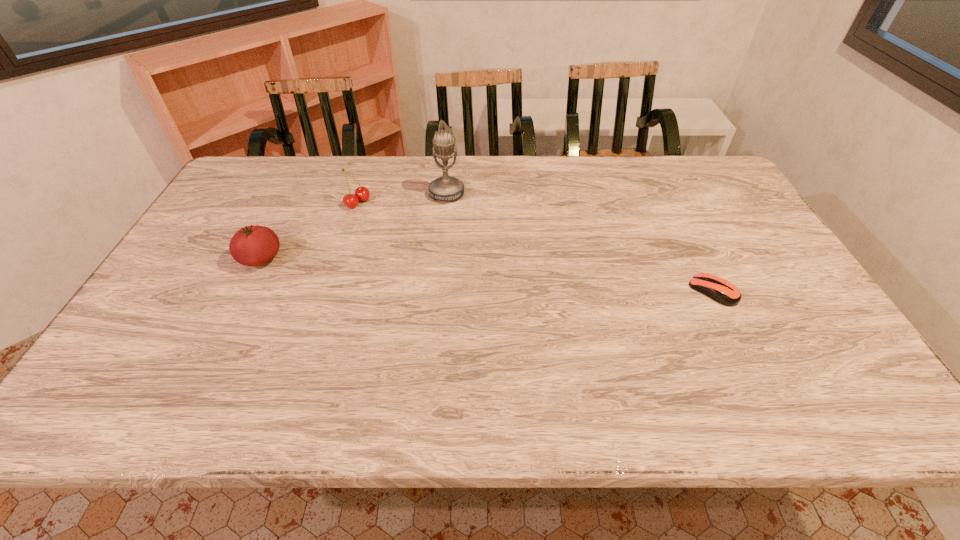
Identify the location of free space between the computer mouse and the cherry. The image size is (960, 540). (536, 247).

At what (x,y) coordinates should I click in order to perform the action: click on vacant space in between the tallest object and the rightmost object. Please return your answer as a coordinate pair (x, y). Looking at the image, I should click on point(580,242).

Locate an element on the screen. The width and height of the screenshot is (960, 540). free spot between the tomato and the third object from right to left is located at coordinates (309, 231).

Identify which object is the closest to the second object from left to right. Please provide its 2D coordinates. Your answer should be formatted as a tuple, i.e. [(x, y)], where the tuple contains the x and y coordinates of a point satisfying the conditions above.

[(445, 188)]

Select which object is the second closest to the shortest object. Please provide its 2D coordinates. Your answer should be formatted as a tuple, i.e. [(x, y)], where the tuple contains the x and y coordinates of a point satisfying the conditions above.

[(361, 193)]

Identify the location of free region that satisfies the following two spatial constraints: 1. on the front side of the rightmost object; 2. on the right side of the third object from right to left. This screenshot has width=960, height=540. (330, 291).

Find the location of a particular element. vacant area in the image that satisfies the following two spatial constraints: 1. on the back side of the second object from right to left; 2. on the left side of the leftmost object is located at coordinates (294, 193).

Image resolution: width=960 pixels, height=540 pixels. I want to click on blank space that satisfies the following two spatial constraints: 1. on the front side of the nearest object; 2. on the left side of the second object from right to left, so click(x=439, y=291).